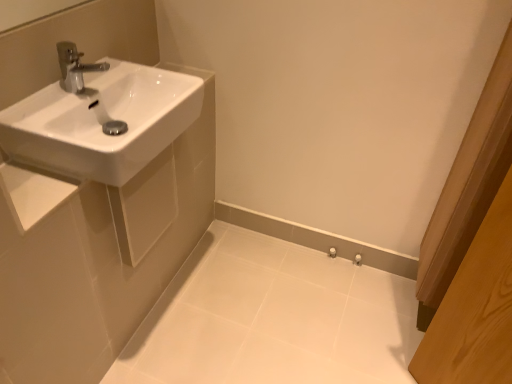
You are a GUI agent. You are given a task and a screenshot of the screen. Output one action in this format:
    pyautogui.click(x=<x>, y=<y>)
    Task: Click on the empty space that is ontop of white glossy porcelain at lower center (from a real-world perspective)
    
    Given the screenshot: What is the action you would take?
    pyautogui.click(x=280, y=313)